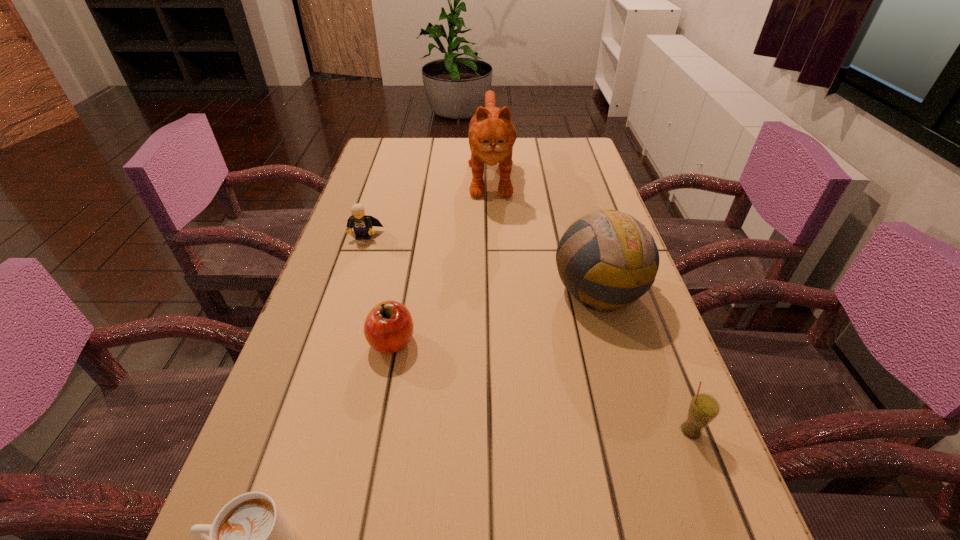
Where is `the farthest object`? the farthest object is located at coordinates (492, 134).

This screenshot has height=540, width=960. What are the coordinates of `the fourth object from left to right` in the screenshot? It's located at (492, 134).

What are the coordinates of `volleyball` in the screenshot? It's located at (607, 259).

Where is `the third tallest object`? The width and height of the screenshot is (960, 540). the third tallest object is located at coordinates (703, 409).

Where is `the fifth farthest object`? This screenshot has height=540, width=960. the fifth farthest object is located at coordinates (703, 409).

This screenshot has width=960, height=540. I want to click on Lego, so click(x=362, y=224).

I want to click on the fourth object from right to left, so click(x=388, y=328).

Locate an element on the screen. vacant region located 0.330m on the face of the farthest object is located at coordinates (495, 294).

Identify the location of vacant space located on the left of the second tallest object. (508, 291).

At what (x,y) coordinates should I click in order to perform the action: click on vacant space located on the left of the third tallest object. Please return your answer as a coordinate pair (x, y). Looking at the image, I should click on (468, 431).